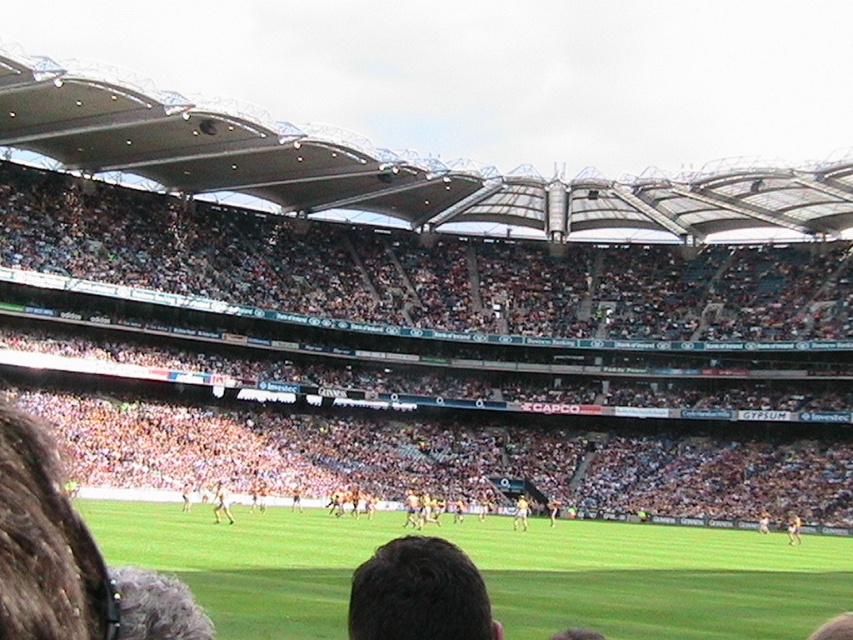
Image resolution: width=853 pixels, height=640 pixels. What do you see at coordinates (654, 579) in the screenshot?
I see `green grass football field at center` at bounding box center [654, 579].

Is green grass football field at center wider than dark brown hair at center?

Yes.

The width and height of the screenshot is (853, 640). What do you see at coordinates (654, 579) in the screenshot?
I see `green grass football field at center` at bounding box center [654, 579].

The image size is (853, 640). What are the coordinates of `green grass football field at center` in the screenshot? It's located at (654, 579).

Can you confirm if dark brown hair at center is taller than light brown leather person at center?

Yes, dark brown hair at center is taller than light brown leather person at center.

Which is above, dark brown hair at center or light brown leather person at center?

dark brown hair at center is higher up.

Does point (412, 552) lie behind point (215, 502)?

No, (412, 552) is in front of (215, 502).

Locate an element on the screen. This screenshot has width=853, height=640. dark brown hair at center is located at coordinates (419, 593).

Is orange plastic seats at center taller than light brown leather person at center?

Correct, orange plastic seats at center is much taller as light brown leather person at center.

Is orange plastic seats at center positioned before light brown leather person at center?

No, orange plastic seats at center is behind light brown leather person at center.

Describe the element at coordinates (463, 348) in the screenshot. I see `orange plastic seats at center` at that location.

Identify the location of orange plastic seats at center. The image size is (853, 640). (463, 348).